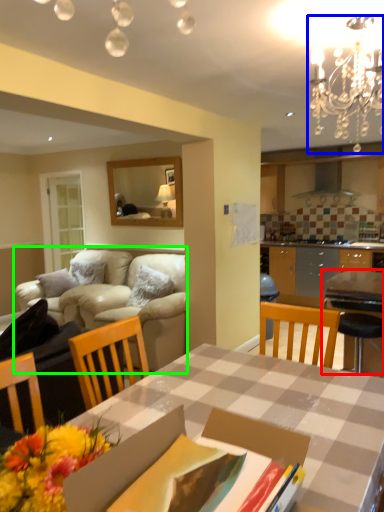
Question: Which is nearer to the table (highlighted by a red box)? light fixture (highlighted by a blue box) or studio couch (highlighted by a green box).

Choices:
 (A) light fixture
 (B) studio couch

Answer: (A)